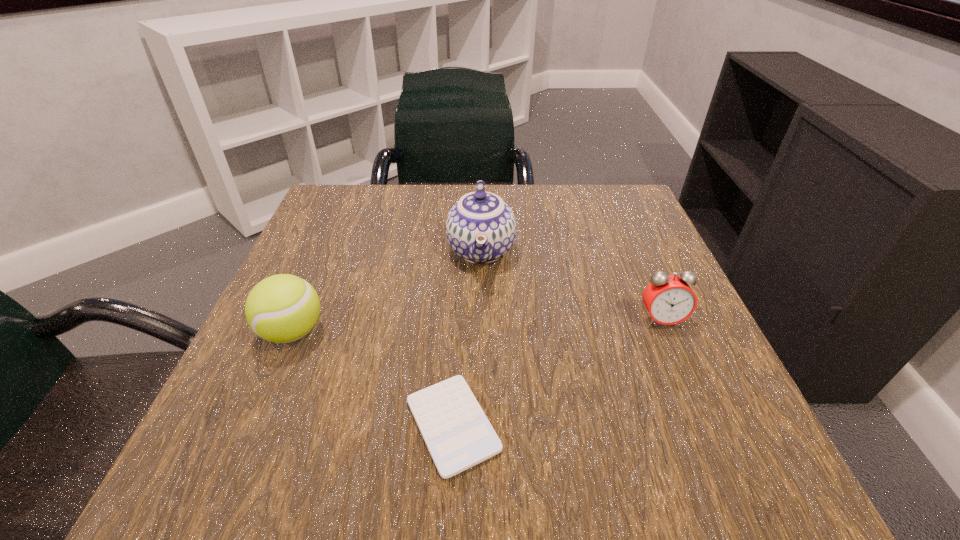
The height and width of the screenshot is (540, 960). Find the location of `vacant space at the far right corner of the desktop`. vacant space at the far right corner of the desktop is located at coordinates (605, 204).

You are a GUI agent. You are given a task and a screenshot of the screen. Output one action in this format:
    pyautogui.click(x=<x>, y=<y>)
    Task: Click on the free space at the near right corner
    
    Given the screenshot: What is the action you would take?
    pyautogui.click(x=657, y=430)

You are a GUI agent. You are given a task and a screenshot of the screen. Output one action in this format:
    pyautogui.click(x=<x>, y=<y>)
    Task: Click on the empty space between the shortest object and the chinaware
    The width and height of the screenshot is (960, 540).
    Given the screenshot: What is the action you would take?
    pyautogui.click(x=467, y=338)

The image size is (960, 540). Identify the location of unoccupied position between the tallest object and the nearest object. (467, 338).

Locate an element on the screen. free spot between the rightmost object and the nearest object is located at coordinates (557, 373).

This screenshot has height=540, width=960. Identify the location of free spot between the tallest object and the leftmost object. (387, 291).

The height and width of the screenshot is (540, 960). I want to click on vacant point located between the farthest object and the leftmost object, so click(x=387, y=291).

The height and width of the screenshot is (540, 960). I want to click on free area in between the alarm clock and the tennis ball, so click(477, 326).

The image size is (960, 540). I want to click on empty space between the leftmost object and the farthest object, so click(387, 291).

This screenshot has width=960, height=540. Identify the location of vacant point located between the rightmost object and the shortest object. (557, 373).